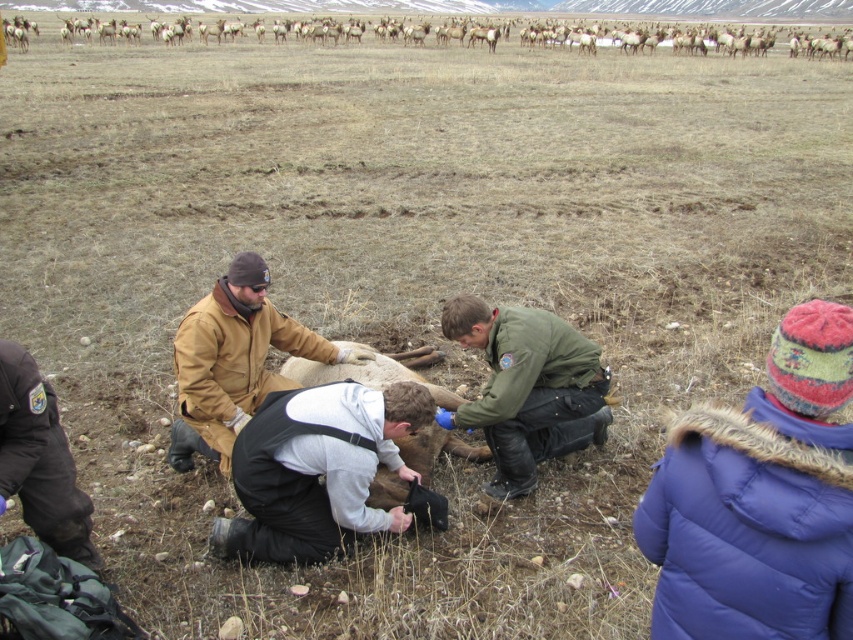
Is dark brown uniform at lower left shorter than brown fur at center?

No.

Does point (84, 513) come closer to viewer compared to point (329, 371)?

That is True.

Where is `dark brown uniform at lower left`? This screenshot has width=853, height=640. dark brown uniform at lower left is located at coordinates (39, 460).

From the picture: Is purple fuzzy coat at lower right above brown fur at upper center?

No.

Between point (836, 401) and point (846, 51), which one is positioned in front?

Positioned in front is point (836, 401).

Is point (804, 449) closer to viewer compared to point (640, 32)?

Yes, it is.

The image size is (853, 640). Identify the location of purple fuzzy coat at lower right. (759, 499).

Is brown fur at upper center shorter than dark brown uniform at lower left?

In fact, brown fur at upper center may be taller than dark brown uniform at lower left.

Can you confirm if brown fur at upper center is wider than dark brown uniform at lower left?

Yes, brown fur at upper center is wider than dark brown uniform at lower left.

Which is behind, point (199, 28) or point (96, 560)?

Positioned behind is point (199, 28).

I want to click on brown fur at upper center, so click(653, 36).